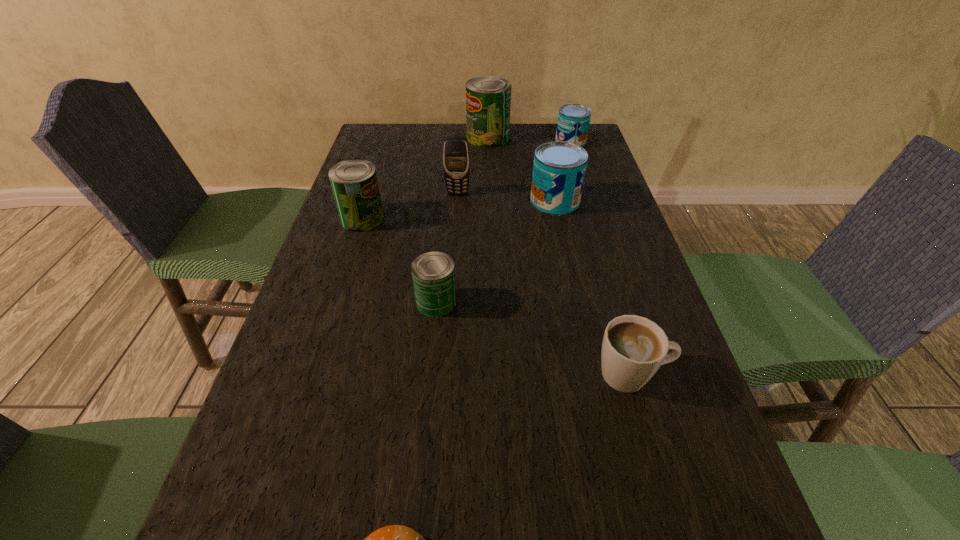
Locate which object is the third closest to the cellular telephone. Please provide its 2D coordinates. Your answer should be formatted as a tuple, i.e. [(x, y)], where the tuple contains the x and y coordinates of a point satisfying the conditions above.

[(488, 99)]

Locate which can is the closest to the third can from right to left. Please provide its 2D coordinates. Your answer should be formatted as a tuple, i.e. [(x, y)], where the tuple contains the x and y coordinates of a point satisfying the conditions above.

[(573, 122)]

I want to click on the fifth closest can to the cellular telephone, so (573, 122).

Locate which green can is the third closest to the smaller blue can. Please provide its 2D coordinates. Your answer should be formatted as a tuple, i.e. [(x, y)], where the tuple contains the x and y coordinates of a point satisfying the conditions above.

[(433, 273)]

You are a GUI agent. You are given a task and a screenshot of the screen. Output one action in this format:
    pyautogui.click(x=<x>, y=<y>)
    Task: Click on the green can that stands as the closest to the second nearest object
    
    Given the screenshot: What is the action you would take?
    pyautogui.click(x=433, y=273)